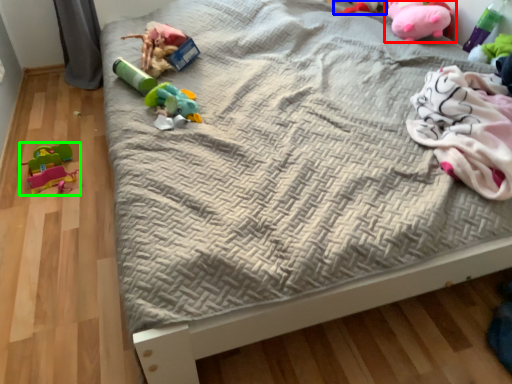
Question: Which object is positioned farthest from toy (highlighted by a red box)? Select from toy (highlighted by a blue box) and toy (highlighted by a green box).

Choices:
 (A) toy
 (B) toy

Answer: (B)